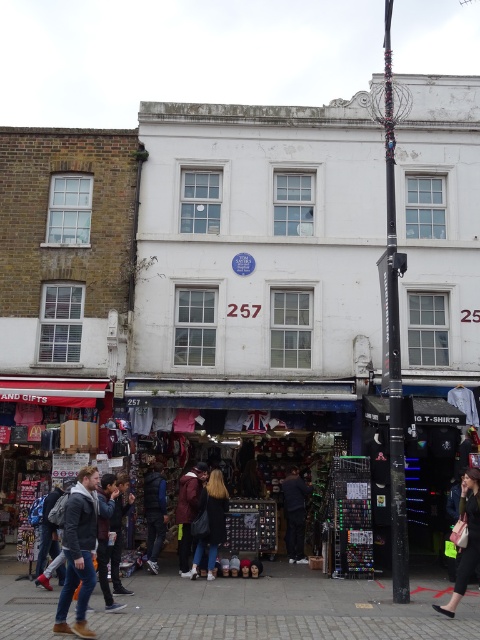
Is point (85, 513) closer to camera compared to point (184, 488)?

Yes, it is in front of point (184, 488).

Is gray leather jacket at lower left below maroon fabric jacket at center?

Incorrect, gray leather jacket at lower left is not positioned below maroon fabric jacket at center.

Does point (83, 566) come behind point (186, 563)?

No, (83, 566) is closer to viewer.

Identify the location of gray leather jacket at lower left. (79, 552).

Is point (200, 515) positioned before point (284, 490)?

Yes, it is.

Who is positioned more to the left, dark brown leather jacket at center or dark blue jeans at center?

Positioned to the left is dark brown leather jacket at center.

Which is behind, point (191, 579) or point (289, 529)?

The point (289, 529) is behind.

Locate an element on the screen. The width and height of the screenshot is (480, 640). dark brown leather jacket at center is located at coordinates [x=210, y=522].

Does matte black jacket at lower right have a lesser width compared to dark blue jeans at center?

Incorrect, matte black jacket at lower right's width is not less than dark blue jeans at center's.

Can you confirm if matte black jacket at lower right is positioned to the right of dark blue jeans at center?

Correct, you'll find matte black jacket at lower right to the right of dark blue jeans at center.

The image size is (480, 640). Find the location of `matte black jacket at lower right`. matte black jacket at lower right is located at coordinates (468, 538).